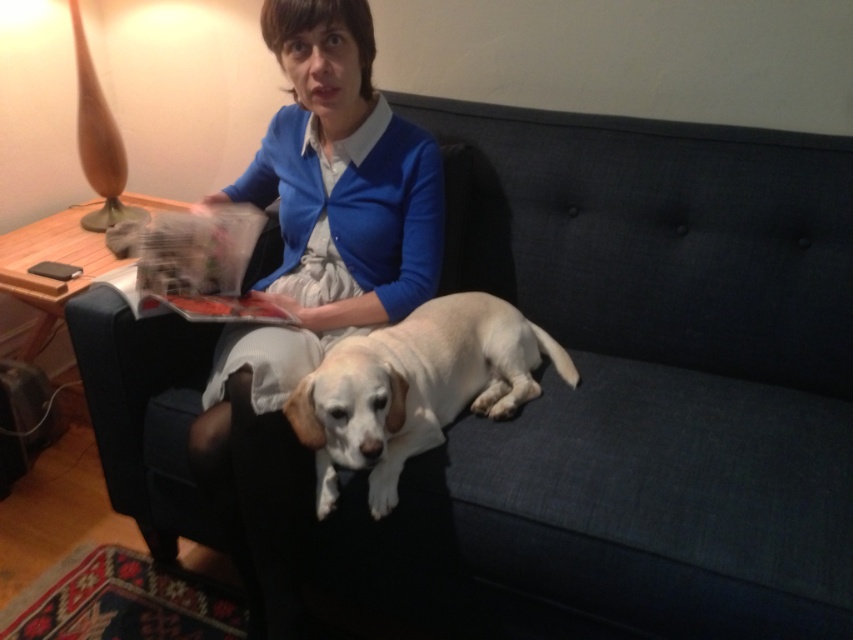
Is point (508, 339) farther from viewer compared to point (94, 433)?

No, (508, 339) is closer to viewer.

Is white fur dog at center further to camera compared to white fabric armchair at center?

No, white fur dog at center is closer to the viewer.

From the picture: Who is more forward, (404, 349) or (274, 260)?

Positioned in front is point (404, 349).

The width and height of the screenshot is (853, 640). I want to click on white fur dog at center, so click(x=415, y=387).

Which is below, matte blue sweater at center or white fabric armchair at center?

Positioned lower is white fabric armchair at center.

Between matte blue sweater at center and white fabric armchair at center, which one appears on the right side from the viewer's perspective?

matte blue sweater at center

Which is behind, point (376, 180) or point (86, 403)?

Point (86, 403)

Locate an element on the screen. The width and height of the screenshot is (853, 640). matte blue sweater at center is located at coordinates (312, 278).

Is point (223, 460) positioned after point (509, 314)?

No, (223, 460) is in front of (509, 314).

Does point (344, 184) come behind point (389, 467)?

Yes, it is.

This screenshot has height=640, width=853. I want to click on matte blue sweater at center, so click(x=312, y=278).